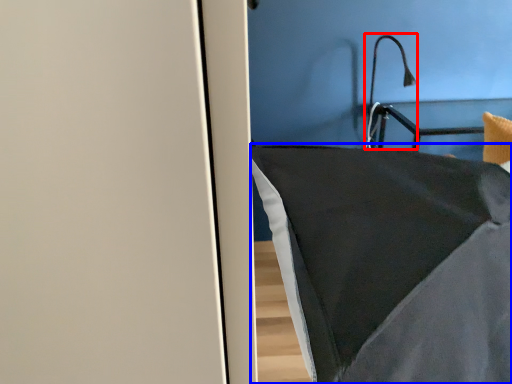
Question: Which object is closer to the camera taking this photo, light fixture (highlighted by a red box) or furniture (highlighted by a blue box)?

Choices:
 (A) light fixture
 (B) furniture

Answer: (B)